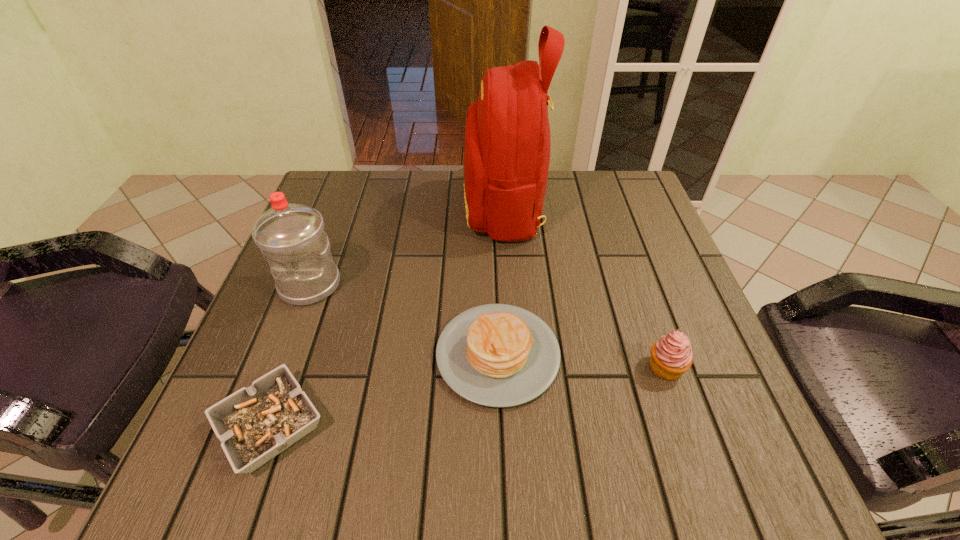
Where is `vacant area between the shortest object and the farthest object`? The height and width of the screenshot is (540, 960). vacant area between the shortest object and the farthest object is located at coordinates (387, 316).

Where is `vacant area between the pancake and the third tallest object`? vacant area between the pancake and the third tallest object is located at coordinates (582, 361).

The height and width of the screenshot is (540, 960). Find the location of `free spot between the third shortest object and the backpack`. free spot between the third shortest object and the backpack is located at coordinates [x=585, y=287].

You are a GUI agent. You are given a task and a screenshot of the screen. Output one action in this format:
    pyautogui.click(x=<x>, y=<y>)
    Task: Click on the free point between the shortest object and the farthest object
    The width and height of the screenshot is (960, 540).
    Given the screenshot: What is the action you would take?
    pyautogui.click(x=387, y=316)

Where is `vacant area between the water bottle and the second shortest object`? Image resolution: width=960 pixels, height=540 pixels. vacant area between the water bottle and the second shortest object is located at coordinates (404, 320).

Select which object appears as the closest to the backpack. Please provide its 2D coordinates. Your answer should be formatted as a tuple, i.e. [(x, y)], where the tuple contains the x and y coordinates of a point satisfying the conditions above.

[(497, 355)]

Locate an element on the screen. This screenshot has width=960, height=540. object that stands as the second closest to the fourth shortest object is located at coordinates (497, 355).

This screenshot has height=540, width=960. I want to click on vacant space that satisfies the following two spatial constraints: 1. on the handle side of the second tallest object; 2. on the right side of the ashtray, so click(257, 426).

Where is `free space that satisfies the following two spatial constraints: 1. on the front-facing side of the tallest object; 2. on the handle side of the second tallest object`? free space that satisfies the following two spatial constraints: 1. on the front-facing side of the tallest object; 2. on the handle side of the second tallest object is located at coordinates (509, 285).

In order to click on free location that satisfies the following two spatial constraints: 1. on the front-facing side of the tallest object; 2. on the back side of the cupcake in this screenshot , I will do `click(515, 367)`.